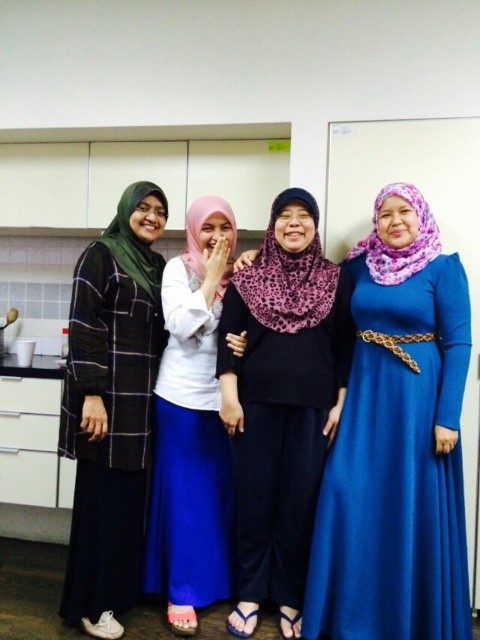
Based on the scene description, which hijab is positioned lower between the purple leopard print hijab at center and the matte black hijab at left?

The purple leopard print hijab at center is located below the matte black hijab at left, so it is positioned lower.

You are a photographer setting up a shoot in a kitchen. You have two hijabs to place on the models. The matte black hijab at left is for the model on the far left, and the white matte hijab at center is for the model in the center. Which hijab should you adjust to ensure both are visible in the frame? Explain your reasoning.

The matte black hijab at left is larger in size than the white matte hijab at center. Since the matte black hijab is larger, it might block more of the frame, so adjusting its position could help ensure both hijabs remain visible.

You are a fashion designer observing the women in the image. You need to place a decorative pin between the purple leopard print hijab at center and the matte black hijab at left. The pin requires 2 inches of space to be securely placed. Can the pin fit between them?

The purple leopard print hijab at center and matte black hijab at left are 17.90 inches apart from each other, so yes, the pin can fit between them since there is more than enough space.